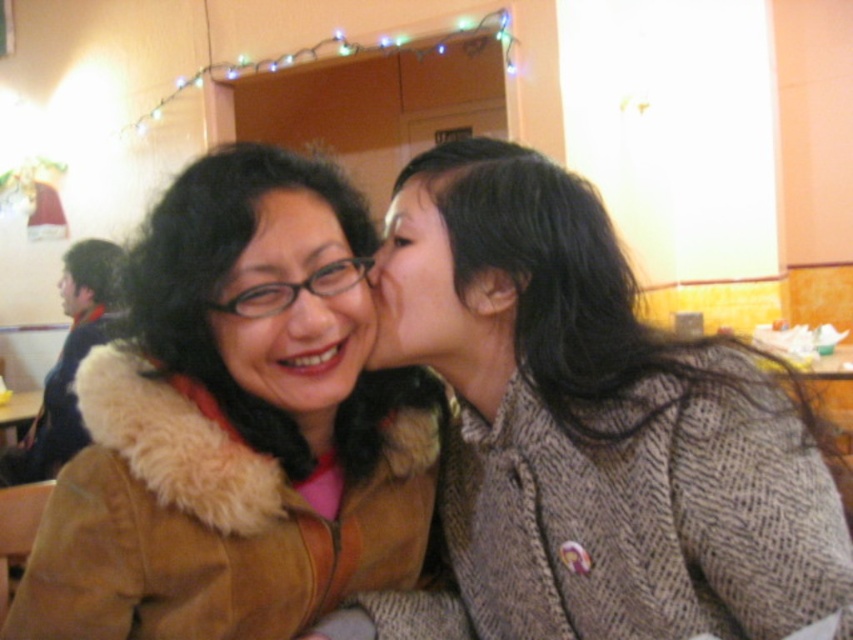
Question: Which point is farther from the camera taking this photo?

Choices:
 (A) (560, 464)
 (B) (434, 288)
 (C) (77, 316)

Answer: (C)

Question: Observing the image, what is the correct spatial positioning of brown suede jacket at upper left in reference to matte brown coat at center?

Choices:
 (A) below
 (B) above

Answer: (A)

Question: Considering the real-world distances, which object is closest to the matte black face at upper left?

Choices:
 (A) matte black hair at center
 (B) brown textured coat at center

Answer: (A)

Question: Which of the following is the closest to the observer?

Choices:
 (A) [283, 289]
 (B) [445, 141]

Answer: (A)

Question: Is brown suede jacket at upper left positioned in front of matte black hair at center?

Choices:
 (A) no
 (B) yes

Answer: (B)

Question: Is brown suede jacket at upper left closer to the viewer compared to matte black face at upper left?

Choices:
 (A) no
 (B) yes

Answer: (B)